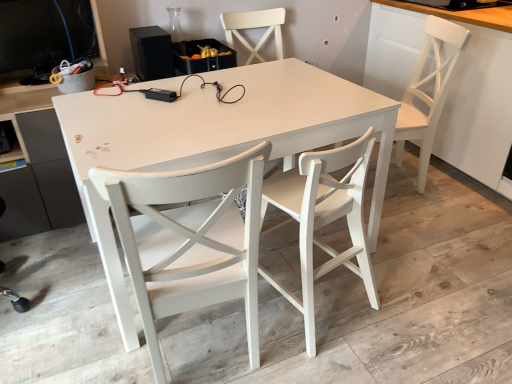
Question: Is white painted wood chair at center, placed as the first chair when sorted from left to right, to the left of white matte table at center from the viewer's perspective?

Choices:
 (A) no
 (B) yes

Answer: (B)

Question: Is white painted wood chair at center, placed as the first chair when sorted from left to right, looking in the opposite direction of white matte table at center?

Choices:
 (A) yes
 (B) no

Answer: (B)

Question: Is white painted wood chair at center, which ranks as the 3th chair in right-to-left order, aimed at white matte table at center?

Choices:
 (A) yes
 (B) no

Answer: (A)

Question: Considering the relative positions of white painted wood chair at center, which ranks as the 3th chair in right-to-left order, and white matte table at center in the image provided, is white painted wood chair at center, which ranks as the 3th chair in right-to-left order, behind white matte table at center?

Choices:
 (A) no
 (B) yes

Answer: (A)

Question: Can you confirm if white painted wood chair at center, placed as the first chair when sorted from left to right, is positioned to the right of white matte table at center?

Choices:
 (A) no
 (B) yes

Answer: (A)

Question: In terms of width, does matte black desktop computer at upper left look wider or thinner when compared to white wood chair at right, positioned as the third chair in left-to-right order?

Choices:
 (A) thin
 (B) wide

Answer: (A)

Question: Considering the positions of point (54, 11) and point (399, 135), is point (54, 11) closer or farther from the camera than point (399, 135)?

Choices:
 (A) closer
 (B) farther

Answer: (A)

Question: From their relative heights in the image, would you say matte black desktop computer at upper left is taller or shorter than white wood chair at right, positioned as the third chair in left-to-right order?

Choices:
 (A) short
 (B) tall

Answer: (A)

Question: From a real-world perspective, is matte black desktop computer at upper left physically located above or below white wood chair at right, the 1th chair from the right?

Choices:
 (A) below
 (B) above

Answer: (B)

Question: Considering the positions of white painted wood chair at center, which ranks as the 3th chair in right-to-left order, and white wood chair at right, the 1th chair from the right, in the image, is white painted wood chair at center, which ranks as the 3th chair in right-to-left order, wider or thinner than white wood chair at right, the 1th chair from the right,?

Choices:
 (A) wide
 (B) thin

Answer: (B)

Question: Would you say white painted wood chair at center, which ranks as the 3th chair in right-to-left order, is to the left or to the right of white wood chair at right, positioned as the third chair in left-to-right order, in the picture?

Choices:
 (A) left
 (B) right

Answer: (A)

Question: Choose the correct answer: Is white painted wood chair at center, which ranks as the 3th chair in right-to-left order, inside white wood chair at right, positioned as the third chair in left-to-right order, or outside it?

Choices:
 (A) inside
 (B) outside

Answer: (B)

Question: In terms of height, does white painted wood chair at center, placed as the first chair when sorted from left to right, look taller or shorter compared to white wood chair at right, positioned as the third chair in left-to-right order?

Choices:
 (A) short
 (B) tall

Answer: (B)

Question: Is white wood chair at center, the 2th chair from the left, in front of or behind black matte speaker at upper left in the image?

Choices:
 (A) front
 (B) behind

Answer: (A)

Question: Does point (323, 173) appear closer or farther from the camera than point (168, 64)?

Choices:
 (A) farther
 (B) closer

Answer: (B)